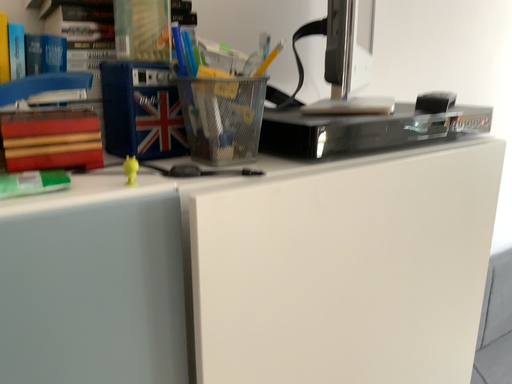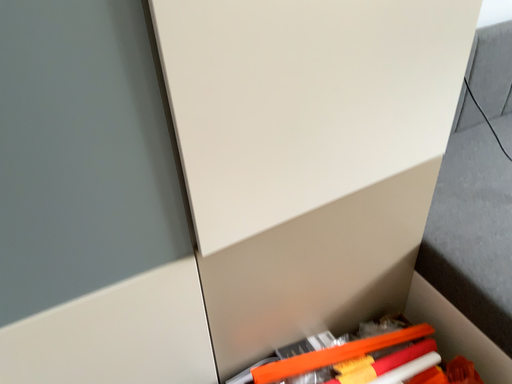
Question: Which way did the camera rotate in the video?

Choices:
 (A) rotated left
 (B) rotated right

Answer: (A)